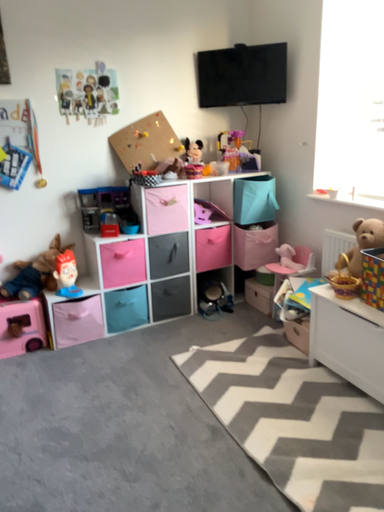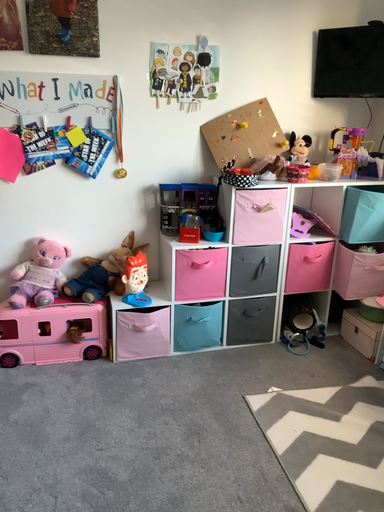
Question: Which way did the camera rotate in the video?

Choices:
 (A) rotated right
 (B) rotated left

Answer: (B)